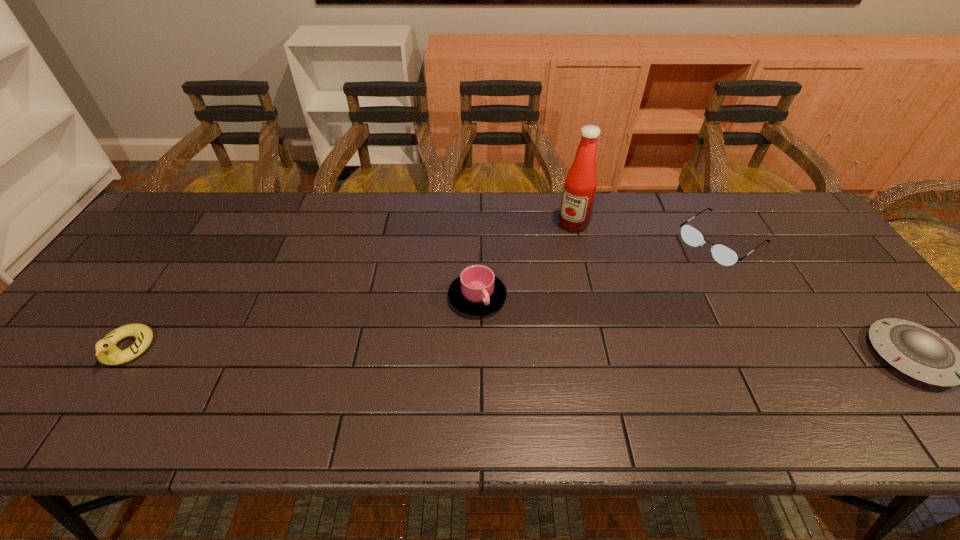
The width and height of the screenshot is (960, 540). I want to click on the leftmost object, so click(107, 352).

Locate an element on the screen. This screenshot has width=960, height=540. cup is located at coordinates (477, 291).

Identify the location of the second object from left to right. This screenshot has width=960, height=540. (477, 291).

Find the location of a particular element. The image size is (960, 540). the third object from right to left is located at coordinates (580, 185).

Locate an element on the screen. Image resolution: width=960 pixels, height=540 pixels. the tallest object is located at coordinates (580, 185).

Where is `the second object from right to left`? This screenshot has width=960, height=540. the second object from right to left is located at coordinates (722, 254).

At what (x,y) coordinates should I click in order to perform the action: click on the fourth tallest object. Please return your answer as a coordinate pair (x, y). This screenshot has width=960, height=540. Looking at the image, I should click on [x=722, y=254].

Locate an element on the screen. free space located on the face of the duckling is located at coordinates (99, 392).

Locate an element on the screen. This screenshot has width=960, height=540. vacant region located 0.290m on the side with the handle of the fourth object from right to left is located at coordinates (582, 396).

This screenshot has width=960, height=540. What are the coordinates of `free point located 0.210m on the side with the handle of the fourth object from right to left` in the screenshot? It's located at (555, 371).